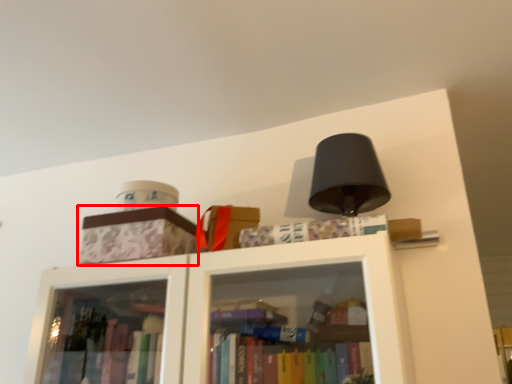
Question: From the image's perspective, what is the correct spatial positioning of cardboard box (annotated by the red box) in reference to book?

Choices:
 (A) below
 (B) above

Answer: (A)